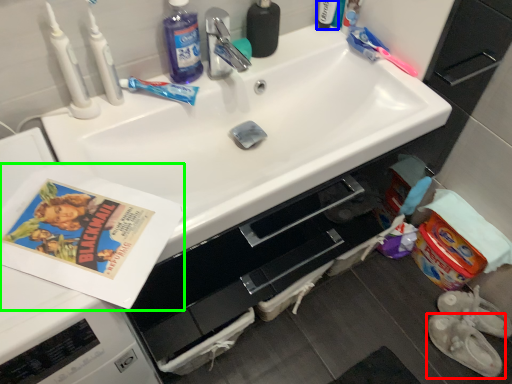
Question: Which object is positioned farthest from footwear (highlighted by a red box)? Select from toiletry (highlighted by a blue box) and paperback book (highlighted by a green box).

Choices:
 (A) toiletry
 (B) paperback book

Answer: (B)